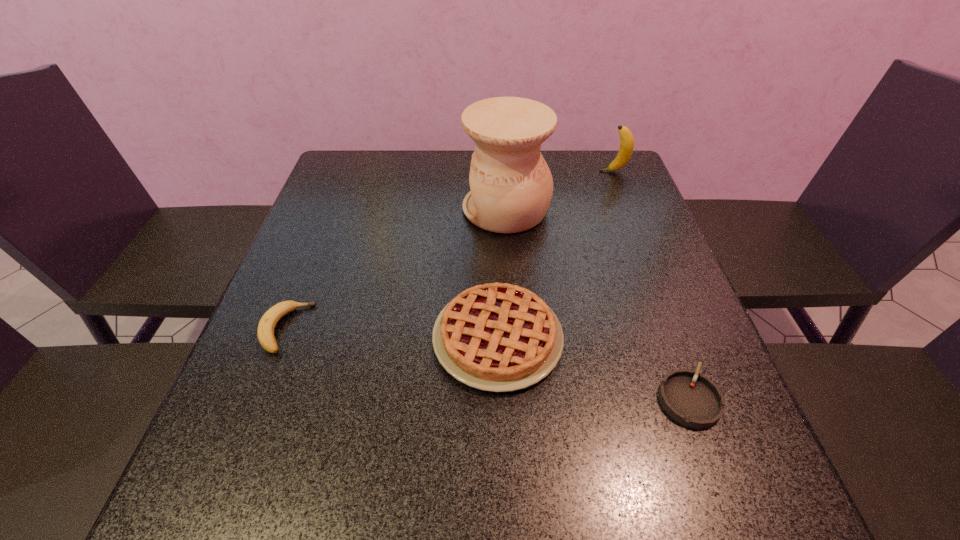
This screenshot has width=960, height=540. Find the location of `free space that is in between the third shortest object and the farther banana`. free space that is in between the third shortest object and the farther banana is located at coordinates (556, 255).

Locate an element on the screen. This screenshot has width=960, height=540. vacant space that's between the pottery and the pie is located at coordinates (502, 273).

I want to click on free space between the second farthest object and the taller banana, so click(560, 190).

The width and height of the screenshot is (960, 540). Find the location of `blank region between the left banana and the pottery`. blank region between the left banana and the pottery is located at coordinates (396, 269).

Identify the location of vacant region between the pottery and the left banana. (396, 269).

Image resolution: width=960 pixels, height=540 pixels. Find the location of `vacant area that lies between the second tallest object and the shorter banana`. vacant area that lies between the second tallest object and the shorter banana is located at coordinates (449, 250).

Identify which object is located as the nearest to the tallest object. Please provide its 2D coordinates. Your answer should be formatted as a tuple, i.e. [(x, y)], where the tuple contains the x and y coordinates of a point satisfying the conditions above.

[(626, 148)]

I want to click on the fourth closest object relative to the tallest object, so click(x=694, y=400).

This screenshot has height=540, width=960. I want to click on vacant space that satisfies the following two spatial constraints: 1. from the stem of the fourth shortest object; 2. on the front side of the third shortest object, so click(679, 338).

Locate an element on the screen. free space that satisfies the following two spatial constraints: 1. at the open side of the tallest object; 2. on the back side of the ashtray is located at coordinates (519, 397).